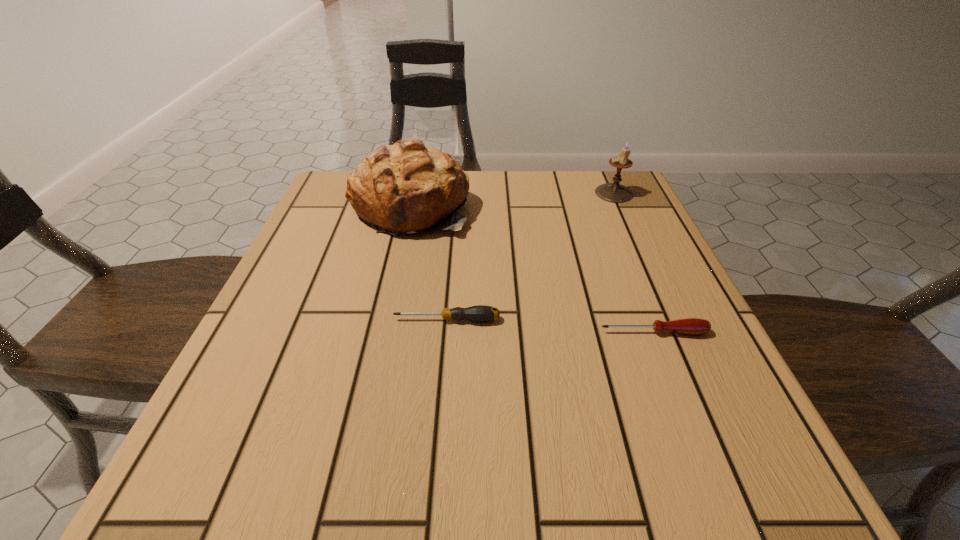
Image resolution: width=960 pixels, height=540 pixels. I want to click on bread located at the far edge, so 406,187.

Identify the location of candle holder that is at the far edge. (614, 192).

Identify the location of object that is at the left edge. (406, 187).

Identify the location of candle holder situated at the right edge. (614, 192).

Identify the location of screwdriver that is at the right edge. This screenshot has height=540, width=960. pyautogui.click(x=692, y=326).

Locate an element on the screen. The image size is (960, 540). object at the far left corner is located at coordinates (406, 187).

Where is `object that is positioned at the far right corner`? This screenshot has height=540, width=960. object that is positioned at the far right corner is located at coordinates (614, 192).

In the image, there is a desktop. Find the location of `vacant space at the far edge`. vacant space at the far edge is located at coordinates point(549,212).

The height and width of the screenshot is (540, 960). In the image, there is a desktop. In order to click on vacant space at the near edge in this screenshot , I will do `click(315, 467)`.

At what (x,y) coordinates should I click in order to perform the action: click on vacant space at the left edge of the desktop. Please return your answer as a coordinate pair (x, y). Looking at the image, I should click on (346, 261).